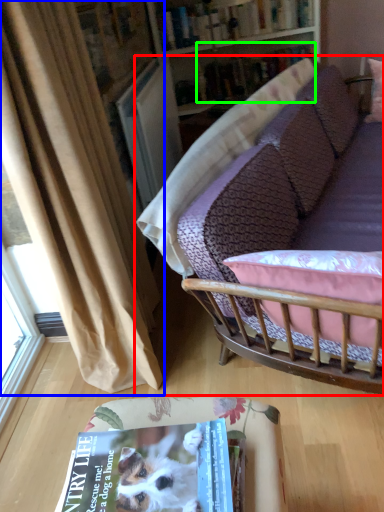
Question: Which object is the closest to the studio couch (highlighted by a red box)? Choose among these: curtain (highlighted by a blue box) or book (highlighted by a green box).

Choices:
 (A) curtain
 (B) book

Answer: (A)